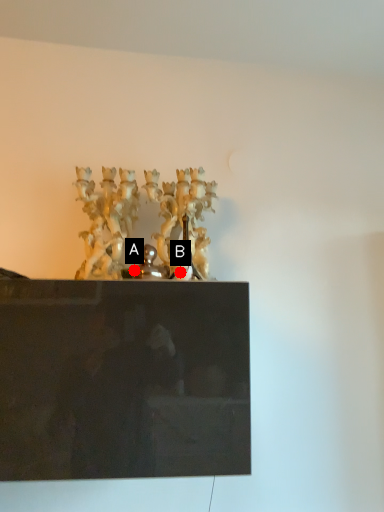
Question: Two points are circled on the image, labeled by A and B beside each circle. Which point appears closest to the camera in this image?

Choices:
 (A) A is closer
 (B) B is closer

Answer: (B)